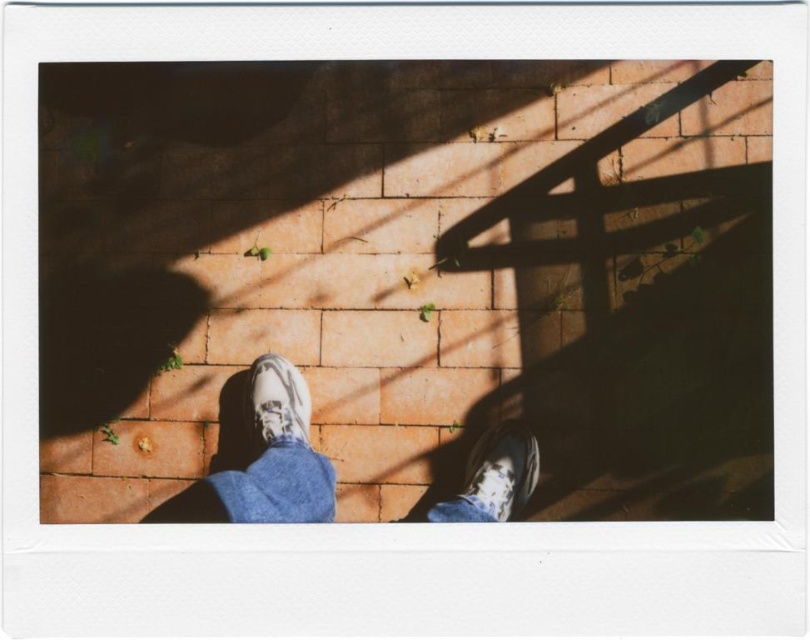
You are a delivery robot with a 12 inch wide package. You need to place the package between the leather sneakers at center and the white matte shoe at lower center. Is there enough space to fit the package between them?

The distance between the leather sneakers at center and the white matte shoe at lower center is 16.71 inches. Since the package is 12 inches wide, there is enough space to fit the package between them.

You are standing on the brick path and want to place your leather sneakers at center exactly where the longest shadow falls. Based on the scene description, where should you position them?

The leather sneakers at center should be placed at point (265, 461) as specified in the description to align with the longest shadow.

You are standing on a brick path and see your white matte shoe at lower center. Where exactly is your white matte shoe located in terms of coordinates?

The white matte shoe at lower center is located at point coordinates of (x=501, y=470).